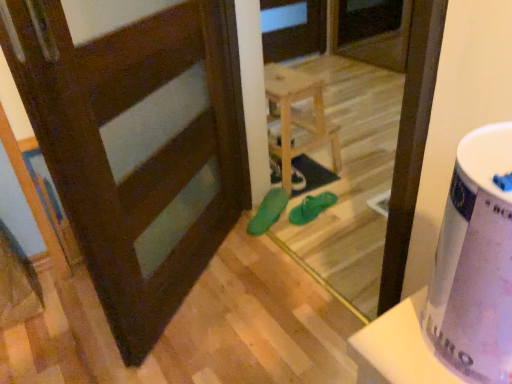
Locate an element on the screen. Image resolution: width=512 pixels, height=384 pixels. vacant space in front of green rubber flip-flops at center, which is the first footwear from right to left is located at coordinates click(x=322, y=233).